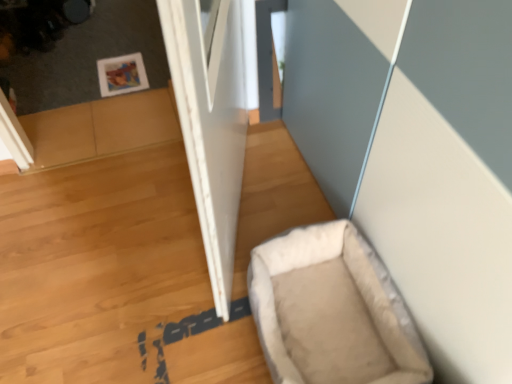
Question: From the image's perspective, is white matte door at center located above or below beige fabric dog bed at lower right?

Choices:
 (A) above
 (B) below

Answer: (A)

Question: In terms of width, does white matte door at center look wider or thinner when compared to beige fabric dog bed at lower right?

Choices:
 (A) thin
 (B) wide

Answer: (A)

Question: Does point tap(208, 64) appear closer or farther from the camera than point tap(364, 370)?

Choices:
 (A) closer
 (B) farther

Answer: (A)

Question: From a real-world perspective, is beige fabric dog bed at lower right positioned above or below white matte door at center?

Choices:
 (A) above
 (B) below

Answer: (B)

Question: From the image's perspective, relative to white matte door at center, is beige fabric dog bed at lower right above or below?

Choices:
 (A) below
 (B) above

Answer: (A)

Question: Is beige fabric dog bed at lower right inside or outside of white matte door at center?

Choices:
 (A) outside
 (B) inside

Answer: (A)

Question: Looking at their shapes, would you say beige fabric dog bed at lower right is wider or thinner than white matte door at center?

Choices:
 (A) wide
 (B) thin

Answer: (A)